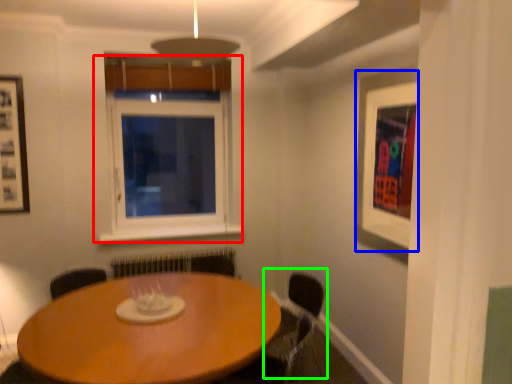
Question: Considering the real-world distances, which object is closest to window (highlighted by a red box)? picture frame (highlighted by a blue box) or armchair (highlighted by a green box).

Choices:
 (A) picture frame
 (B) armchair

Answer: (B)